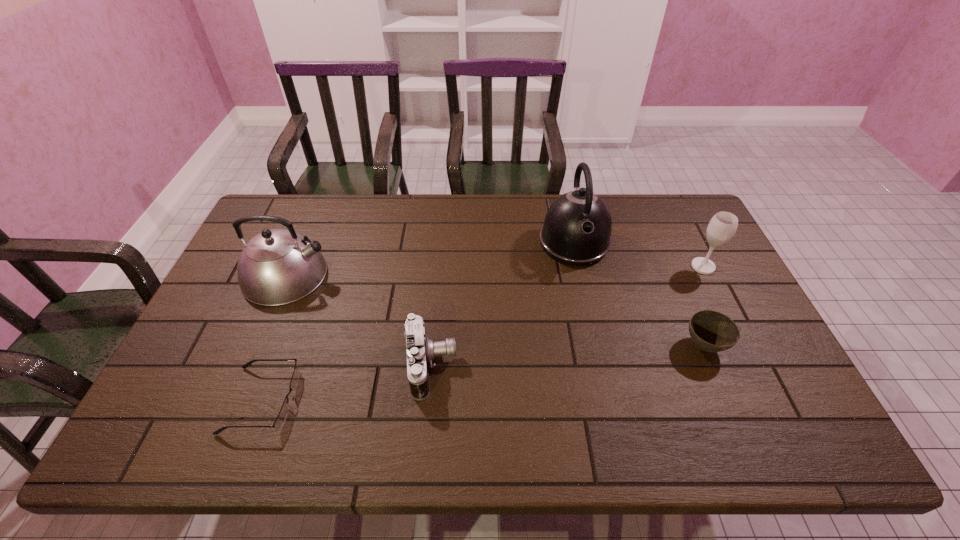
Find the location of `free space between the left kettle and the camera`. free space between the left kettle and the camera is located at coordinates (359, 320).

Where is `vacant space that is in between the second object from right to left and the right kettle`? vacant space that is in between the second object from right to left and the right kettle is located at coordinates [x=639, y=294].

The width and height of the screenshot is (960, 540). I want to click on blank region between the wineglass and the shorter kettle, so click(494, 271).

Identify the location of free space between the fourth tallest object and the right kettle. This screenshot has width=960, height=540. (503, 304).

At what (x,y) coordinates should I click in order to perform the action: click on free space between the shorter kettle and the rightmost object. Please return your answer as a coordinate pair (x, y). The width and height of the screenshot is (960, 540). Looking at the image, I should click on click(494, 271).

This screenshot has width=960, height=540. In order to click on object that is the fifth closest to the fifth tallest object in this screenshot , I will do click(278, 266).

Locate an element on the screen. object that ranks as the closest to the wineglass is located at coordinates (711, 331).

Where is `vacant space that satisfies the following two spatial constraints: 1. on the spout of the tallest object; 2. on the front-facing side of the shortest object`? vacant space that satisfies the following two spatial constraints: 1. on the spout of the tallest object; 2. on the front-facing side of the shortest object is located at coordinates (609, 400).

What are the coordinates of `free space that satisfies the following two spatial constraints: 1. on the spout of the taller kettle; 2. from the spout of the left kettle` in the screenshot? It's located at (581, 275).

The width and height of the screenshot is (960, 540). In order to click on free space that satisfies the following two spatial constraints: 1. from the spout of the second object from right to left; 2. on the left side of the shorter kettle in this screenshot , I will do `click(256, 346)`.